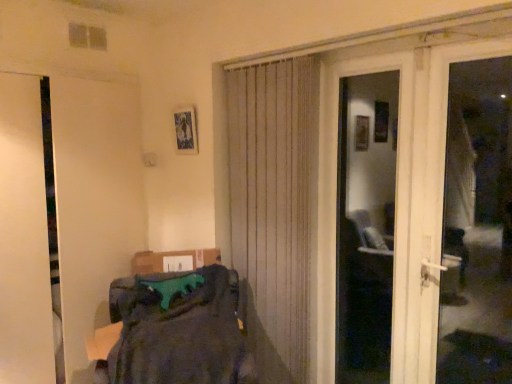
In order to face white plastic door handle at right, should I rotate leftwards or rightwards?

Turn right approximately 26.803 degrees to face it.

In order to face white glossy door at center, the 1th door from the right, should I rotate leftwards or rightwards?

Rotate your view right by about 14.293°.

The height and width of the screenshot is (384, 512). What do you see at coordinates (180, 332) in the screenshot?
I see `dark gray fabric at lower left` at bounding box center [180, 332].

What is the approximate height of dark gray fabric at lower left?

The height of dark gray fabric at lower left is 25.06 inches.

Describe the element at coordinates (275, 205) in the screenshot. I see `beige textured curtain at center` at that location.

What do you see at coordinates (186, 130) in the screenshot? Image resolution: width=512 pixels, height=384 pixels. I see `metallic silver picture frame at upper center` at bounding box center [186, 130].

What do you see at coordinates (94, 200) in the screenshot? The width and height of the screenshot is (512, 384). I see `white matte door at left, the 2th door from the right` at bounding box center [94, 200].

This screenshot has height=384, width=512. In order to click on white plastic door handle at right in this screenshot , I will do `click(477, 226)`.

Is dark gray fabric at lower left completely or partially inside white matte door at left, the 1th door in the left-to-right sequence?

That's incorrect, dark gray fabric at lower left is not inside white matte door at left, the 1th door in the left-to-right sequence.

Can you tell me how much white matte door at left, the 1th door in the left-to-right sequence, and dark gray fabric at lower left differ in facing direction?

The facing directions of white matte door at left, the 1th door in the left-to-right sequence, and dark gray fabric at lower left are 34.7 degrees apart.

Can you confirm if white matte door at left, the 2th door from the right, is thinner than dark gray fabric at lower left?

Correct, the width of white matte door at left, the 2th door from the right, is less than that of dark gray fabric at lower left.

Does point (119, 117) lie in front of point (237, 344)?

That is False.

Is white matte door at left, the 2th door from the right, turned away from beige textured curtain at center?

No, white matte door at left, the 2th door from the right, is not facing the opposite direction of beige textured curtain at center.

Which object is wider, white matte door at left, the 2th door from the right, or beige textured curtain at center?

white matte door at left, the 2th door from the right.

Image resolution: width=512 pixels, height=384 pixels. What are the coordinates of `door below the beige textured curtain at center (from the image's perspective)` in the screenshot? It's located at (94, 200).

From a real-world perspective, is white matte door at left, the 1th door in the left-to-right sequence, positioned above or below beige textured curtain at center?

From a real-world perspective, white matte door at left, the 1th door in the left-to-right sequence, is physically below beige textured curtain at center.

Is white glossy door at center, the 1th door from the right, wider or thinner than white plastic door handle at right?

Clearly, white glossy door at center, the 1th door from the right, has less width compared to white plastic door handle at right.

Can white plastic door handle at right be found inside white glossy door at center, arranged as the second door when viewed from the left?

That's incorrect, white plastic door handle at right is not inside white glossy door at center, arranged as the second door when viewed from the left.

Between white glossy door at center, the 1th door from the right, and white plastic door handle at right, which one appears on the right side from the viewer's perspective?

white plastic door handle at right.

Does white glossy door at center, arranged as the second door when viewed from the left, turn towards white plastic door handle at right?

No, white glossy door at center, arranged as the second door when viewed from the left, is not turned towards white plastic door handle at right.

Could you tell me if metallic silver picture frame at upper center is turned towards white glossy door at center, arranged as the second door when viewed from the left?

No, metallic silver picture frame at upper center is not turned towards white glossy door at center, arranged as the second door when viewed from the left.

Between point (187, 149) and point (398, 135), which one is positioned in front?

Positioned in front is point (398, 135).

Based on the photo, considering the sizes of metallic silver picture frame at upper center and white glossy door at center, arranged as the second door when viewed from the left, in the image, is metallic silver picture frame at upper center taller or shorter than white glossy door at center, arranged as the second door when viewed from the left,?

metallic silver picture frame at upper center is shorter than white glossy door at center, arranged as the second door when viewed from the left.

Considering the sizes of objects white plastic door handle at right and dark gray fabric at lower left in the image provided, who is wider, white plastic door handle at right or dark gray fabric at lower left?

dark gray fabric at lower left is wider.

Looking at this image, can you tell me how much white plastic door handle at right and dark gray fabric at lower left differ in facing direction?

They differ by 55.3 degrees in their facing directions.

From the image's perspective, is white plastic door handle at right located above or below dark gray fabric at lower left?

white plastic door handle at right is situated higher than dark gray fabric at lower left in the image.

From a real-world perspective, is white plastic door handle at right positioned under dark gray fabric at lower left based on gravity?

No, from a real-world perspective, white plastic door handle at right is not under dark gray fabric at lower left.

Is metallic silver picture frame at upper center next to white matte door at left, the 2th door from the right?

No, metallic silver picture frame at upper center is not making contact with white matte door at left, the 2th door from the right.

Is white matte door at left, the 1th door in the left-to-right sequence, a part of metallic silver picture frame at upper center?

No, white matte door at left, the 1th door in the left-to-right sequence, is not surrounded by metallic silver picture frame at upper center.

Find the location of a particular element. The image size is (512, 384). the 1st door in front when counting from the metallic silver picture frame at upper center is located at coordinates (94, 200).

Considering the positions of objects metallic silver picture frame at upper center and white matte door at left, the 1th door in the left-to-right sequence, in the image provided, who is more to the right, metallic silver picture frame at upper center or white matte door at left, the 1th door in the left-to-right sequence,?

From the viewer's perspective, metallic silver picture frame at upper center appears more on the right side.

Looking at this image, from a real-world perspective, is beige textured curtain at center located beneath metallic silver picture frame at upper center?

Yes, from a real-world perspective, beige textured curtain at center is beneath metallic silver picture frame at upper center.

Identify the location of picture frame to the left of beige textured curtain at center. The image size is (512, 384). (186, 130).

Can you confirm if beige textured curtain at center is shorter than metallic silver picture frame at upper center?

No.

This screenshot has width=512, height=384. I want to click on the 2nd door behind the dark gray fabric at lower left, so click(x=94, y=200).

Where is `door below the beige textured curtain at center (from a real-world perspective)`? Image resolution: width=512 pixels, height=384 pixels. door below the beige textured curtain at center (from a real-world perspective) is located at coordinates click(94, 200).

Based on their spatial positions, is metallic silver picture frame at upper center or dark gray fabric at lower left closer to white matte door at left, the 1th door in the left-to-right sequence?

The object closer to white matte door at left, the 1th door in the left-to-right sequence, is metallic silver picture frame at upper center.

From the image, which object appears to be nearer to dark gray fabric at lower left, white plastic door handle at right or white matte door at left, the 1th door in the left-to-right sequence?

white matte door at left, the 1th door in the left-to-right sequence, is closer to dark gray fabric at lower left.

Which object lies further to the anchor point metallic silver picture frame at upper center, white glossy door at center, arranged as the second door when viewed from the left, or dark gray fabric at lower left?

Based on the image, white glossy door at center, arranged as the second door when viewed from the left, appears to be further to metallic silver picture frame at upper center.

Looking at the image, which one is located further to metallic silver picture frame at upper center, dark gray fabric at lower left or white matte door at left, the 1th door in the left-to-right sequence?

The object further to metallic silver picture frame at upper center is dark gray fabric at lower left.

Which object lies further to the anchor point metallic silver picture frame at upper center, dark gray fabric at lower left or white plastic door handle at right?

The object further to metallic silver picture frame at upper center is white plastic door handle at right.

In the scene shown: When comparing their distances from metallic silver picture frame at upper center, does white plastic door handle at right or white glossy door at center, the 1th door from the right, seem further?

white plastic door handle at right lies further to metallic silver picture frame at upper center than the other object.

Looking at the image, which one is located further to white glossy door at center, arranged as the second door when viewed from the left, dark gray fabric at lower left or metallic silver picture frame at upper center?

Among the two, metallic silver picture frame at upper center is located further to white glossy door at center, arranged as the second door when viewed from the left.

When comparing their distances from white glossy door at center, arranged as the second door when viewed from the left, does beige textured curtain at center or dark gray fabric at lower left seem further?

dark gray fabric at lower left.

The width and height of the screenshot is (512, 384). What are the coordinates of `laundry between white matte door at left, the 1th door in the left-to-right sequence, and white plastic door handle at right` in the screenshot? It's located at (180, 332).

Where is `curtain located between metallic silver picture frame at upper center and white glossy door at center, the 1th door from the right, in the left-right direction`? The image size is (512, 384). curtain located between metallic silver picture frame at upper center and white glossy door at center, the 1th door from the right, in the left-right direction is located at coordinates (275, 205).

The height and width of the screenshot is (384, 512). In order to click on door between white matte door at left, the 1th door in the left-to-right sequence, and white plastic door handle at right in this screenshot , I will do pyautogui.click(x=396, y=210).

Locate an element on the screen. This screenshot has width=512, height=384. picture frame between white matte door at left, the 1th door in the left-to-right sequence, and white glossy door at center, arranged as the second door when viewed from the left is located at coordinates (186, 130).